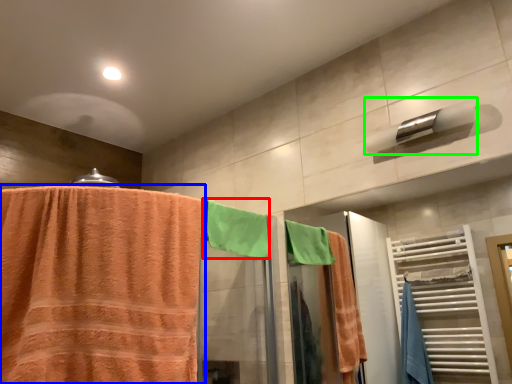
Question: Estimate the real-world distances between objects in this image. Which object is farther from beach towel (highlighted by a red box), towel (highlighted by a blue box) or towel bar (highlighted by a green box)?

Choices:
 (A) towel
 (B) towel bar

Answer: (B)